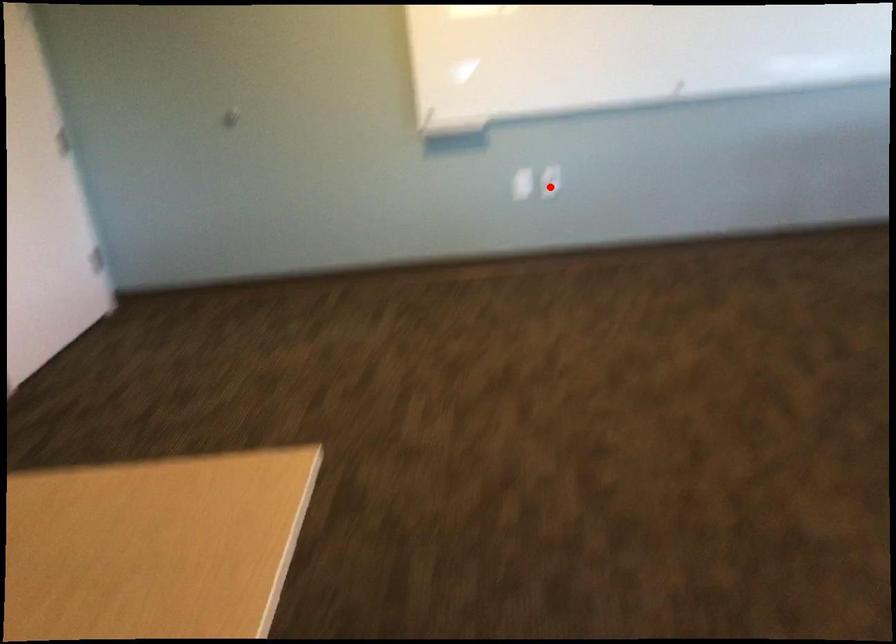
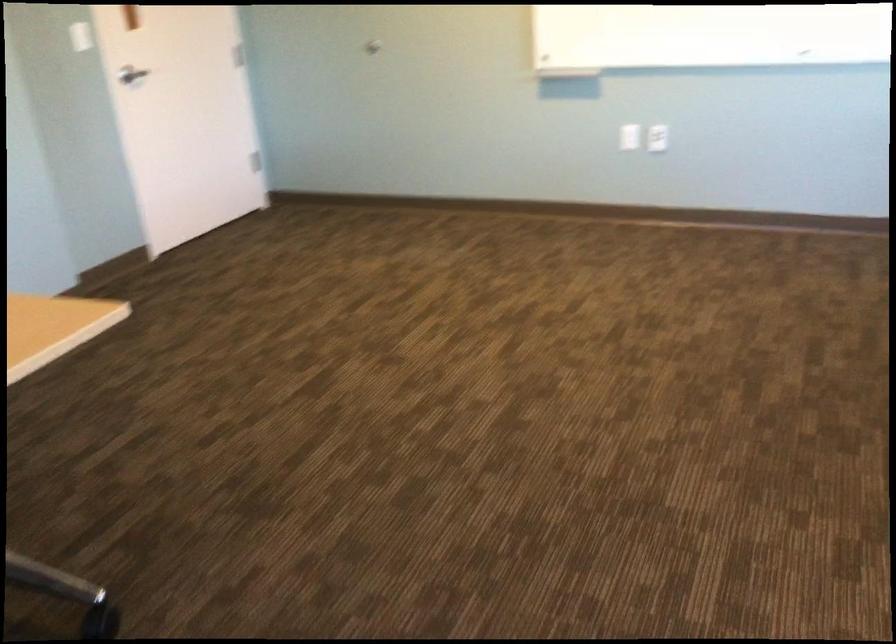
The point at the highlighted location is marked in the first image. Where is the corresponding point in the second image?

(657, 138)